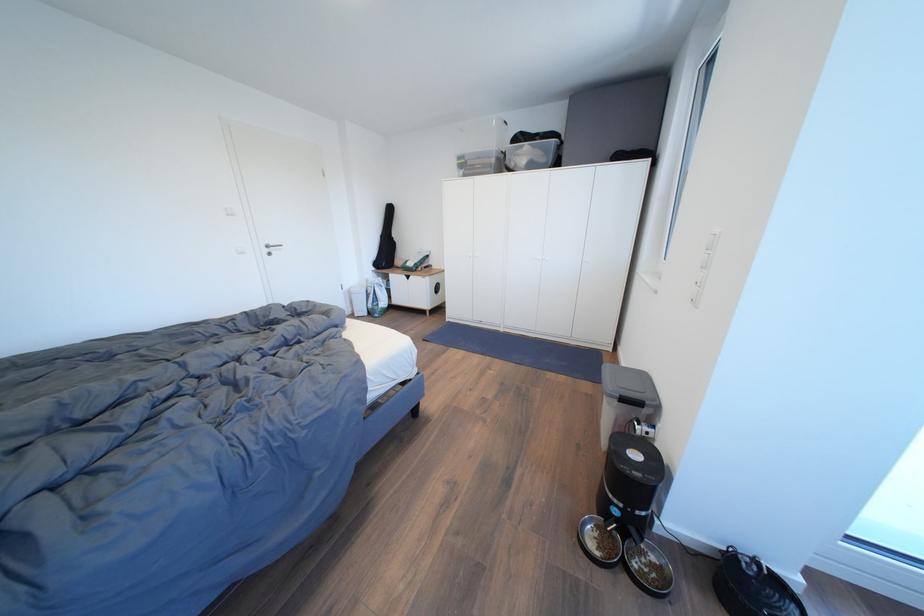
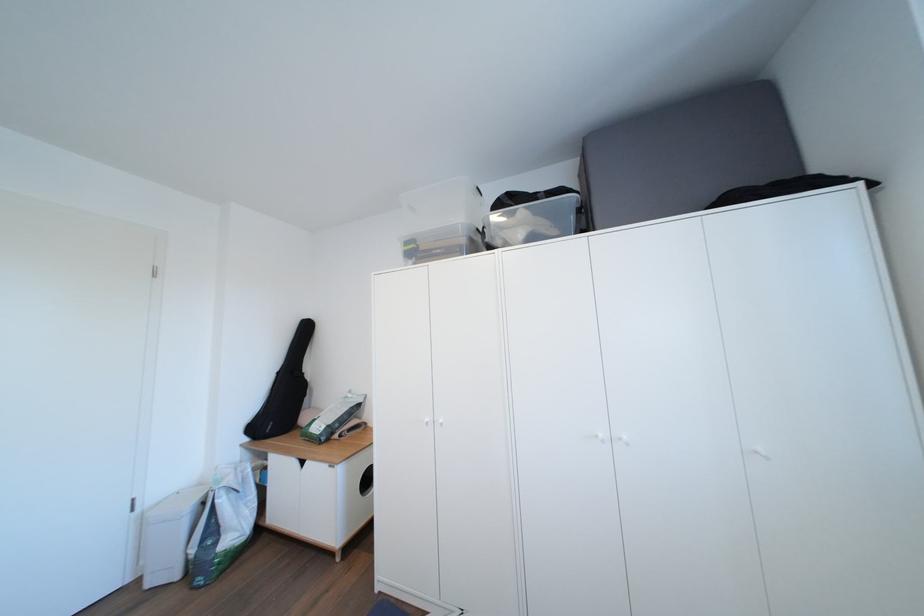
Locate, in the second image, the point that corresponds to point 394,262 in the first image.

(289, 416)